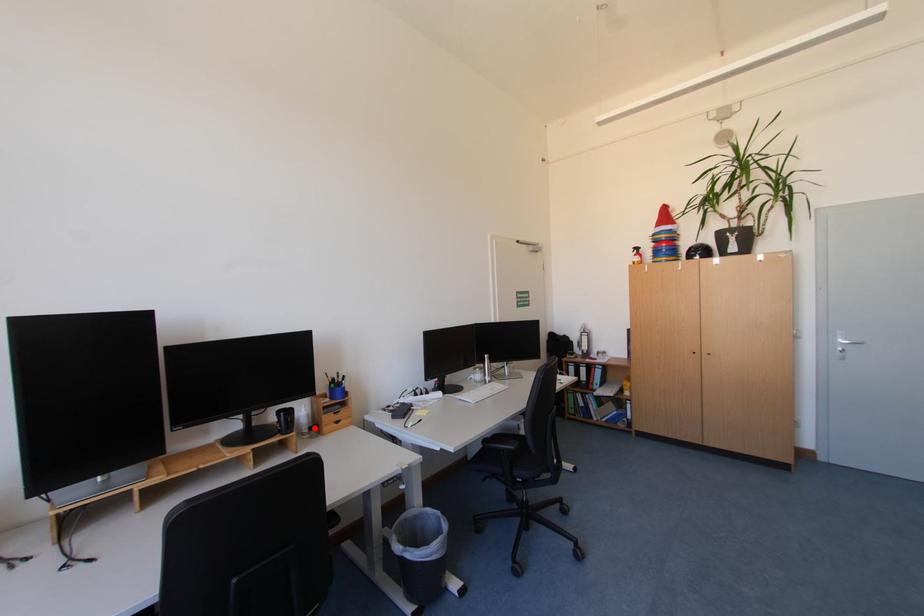
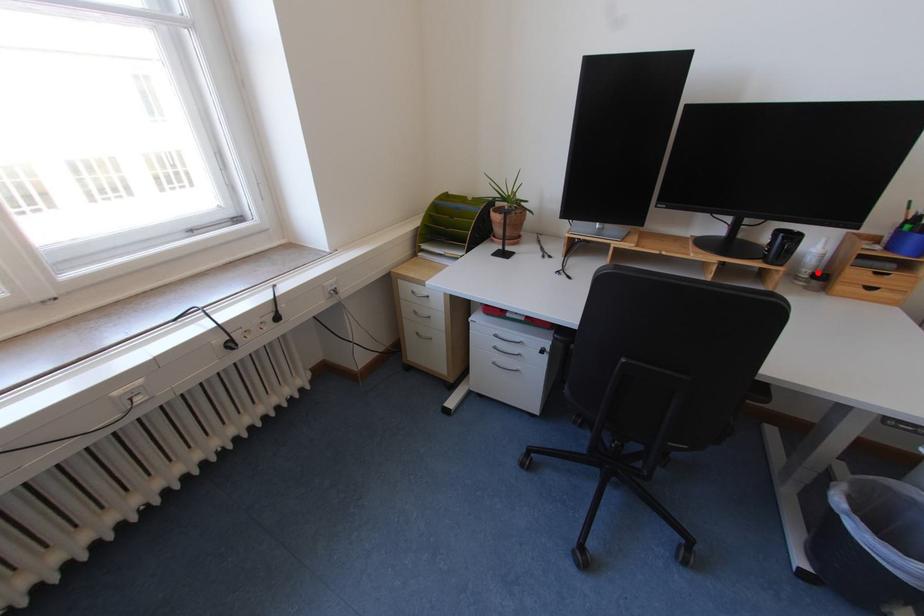
I am providing you with two images of the same scene from different viewpoints. A red point is marked on the first image and another point is marked on the second image. Are the points marked in image1 and image2 representing the same 3D position?

Yes